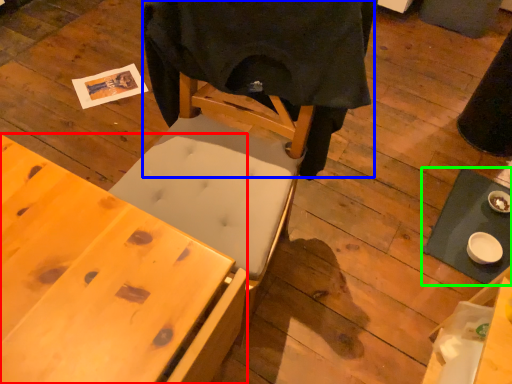
Question: Based on their relative distances, which object is farther from desk (highlighted by a red box)? Choose from cloth (highlighted by a blue box) and table (highlighted by a green box).

Choices:
 (A) cloth
 (B) table

Answer: (B)